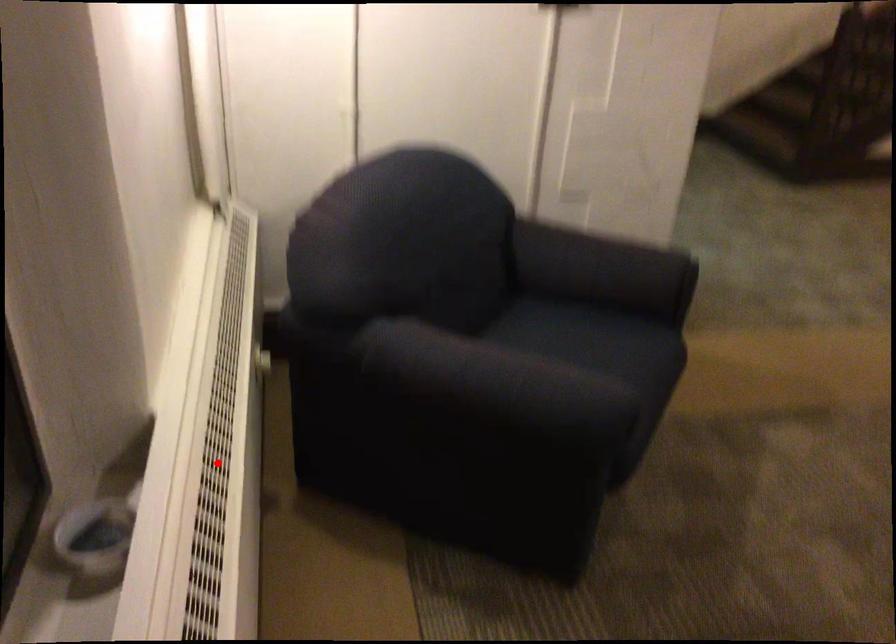
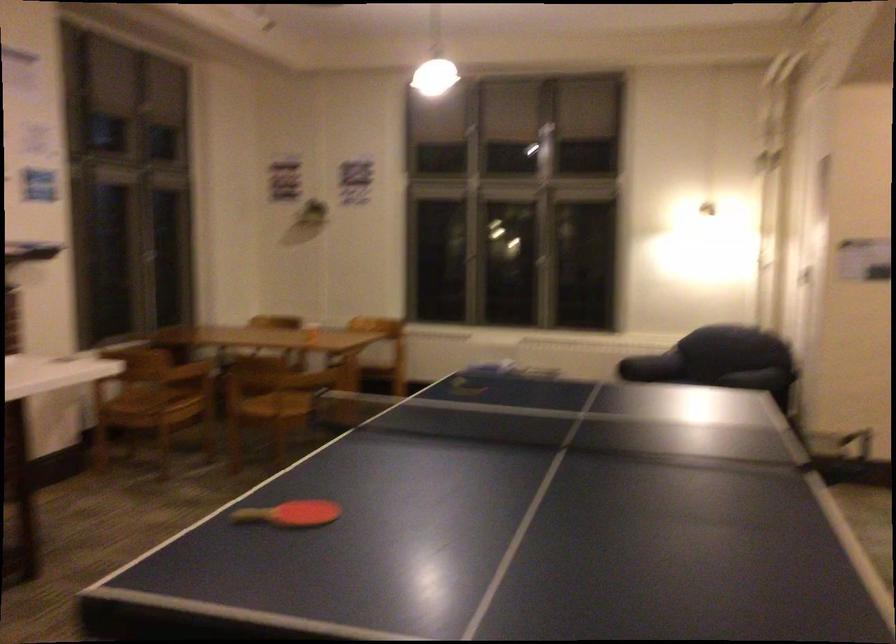
Question: I am providing you with two images of the same scene from different viewpoints. A red point is marked on the first image. Can you still see the location of the red point in image 2?

Choices:
 (A) Yes
 (B) No

Answer: (B)